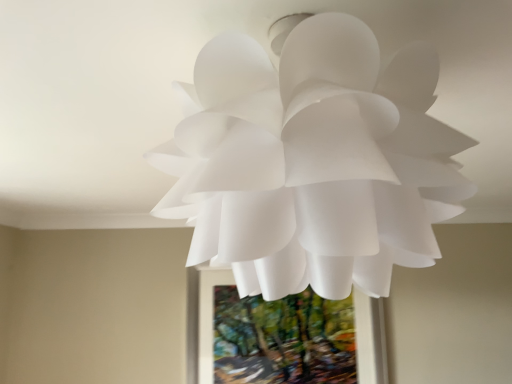
Describe the element at coordinates (312, 160) in the screenshot. The image size is (512, 384). I see `white matte paper flower at center` at that location.

At what (x,y) coordinates should I click in order to perform the action: click on white matte paper flower at center. Please return your answer as a coordinate pair (x, y). Looking at the image, I should click on tap(312, 160).

Image resolution: width=512 pixels, height=384 pixels. Find the location of `green textured painting at center`. green textured painting at center is located at coordinates (283, 339).

What do you see at coordinates (283, 339) in the screenshot? I see `green textured painting at center` at bounding box center [283, 339].

What are the coordinates of `white matte paper flower at center` in the screenshot? It's located at (312, 160).

Which object is positioned more to the left, white matte paper flower at center or green textured painting at center?

white matte paper flower at center.

Is white matte paper flower at center closer to the viewer compared to green textured painting at center?

Yes, white matte paper flower at center is closer to the viewer.

Is point (332, 95) positioned before point (327, 334)?

Yes, point (332, 95) is closer to viewer.

From the image's perspective, which object appears higher, white matte paper flower at center or green textured painting at center?

white matte paper flower at center appears higher in the image.

From a real-world perspective, between white matte paper flower at center and green textured painting at center, who is vertically lower?

green textured painting at center.

Based on the photo, between white matte paper flower at center and green textured painting at center, which one has larger width?

white matte paper flower at center.

Which of these two, white matte paper flower at center or green textured painting at center, stands shorter?

With less height is white matte paper flower at center.

Looking at the image, does white matte paper flower at center seem bigger or smaller compared to green textured painting at center?

white matte paper flower at center is bigger than green textured painting at center.

Is white matte paper flower at center spatially inside green textured painting at center, or outside of it?

The correct answer is: outside.

Would you say white matte paper flower at center is a long distance from green textured painting at center?

white matte paper flower at center is far away from green textured painting at center.

Is white matte paper flower at center positioned with its back to green textured painting at center?

No.

You are a GUI agent. You are given a task and a screenshot of the screen. Output one action in this format:
    pyautogui.click(x=<x>, y=<y>)
    Task: Click on the flower above the green textured painting at center (from the image's perspective)
    Image resolution: width=512 pixels, height=384 pixels.
    Given the screenshot: What is the action you would take?
    pyautogui.click(x=312, y=160)

Which is more to the right, green textured painting at center or white matte paper flower at center?

Positioned to the right is green textured painting at center.

Is the position of green textured painting at center more distant than that of white matte paper flower at center?

Yes, green textured painting at center is further from the camera.

Does point (330, 304) lie behind point (391, 244)?

Yes, it is behind point (391, 244).

From the image's perspective, is green textured painting at center above or below white matte paper flower at center?

Clearly, from the image's perspective, green textured painting at center is below white matte paper flower at center.

From a real-world perspective, does green textured painting at center sit lower than white matte paper flower at center?

Yes.

Which object is wider, green textured painting at center or white matte paper flower at center?

With larger width is white matte paper flower at center.

From their relative heights in the image, would you say green textured painting at center is taller or shorter than white matte paper flower at center?

Considering their sizes, green textured painting at center has more height than white matte paper flower at center.

Considering the relative sizes of green textured painting at center and white matte paper flower at center in the image provided, is green textured painting at center smaller than white matte paper flower at center?

Correct, green textured painting at center occupies less space than white matte paper flower at center.

Is white matte paper flower at center located within green textured painting at center?

No, white matte paper flower at center is not inside green textured painting at center.

Is green textured painting at center touching white matte paper flower at center?

green textured painting at center is not next to white matte paper flower at center, and they're not touching.

Is green textured painting at center looking in the opposite direction of white matte paper flower at center?

That's not correct — green textured painting at center is not looking away from white matte paper flower at center.

What's the angular difference between green textured painting at center and white matte paper flower at center's facing directions?

green textured painting at center and white matte paper flower at center are facing 90.7 degrees away from each other.

The image size is (512, 384). I want to click on flower to the left of green textured painting at center, so click(x=312, y=160).

In the image, there is a white matte paper flower at center. What are the coordinates of `tree below it (from the image's perspective)` in the screenshot? It's located at (283, 339).

This screenshot has width=512, height=384. I want to click on flower above the green textured painting at center (from a real-world perspective), so click(x=312, y=160).